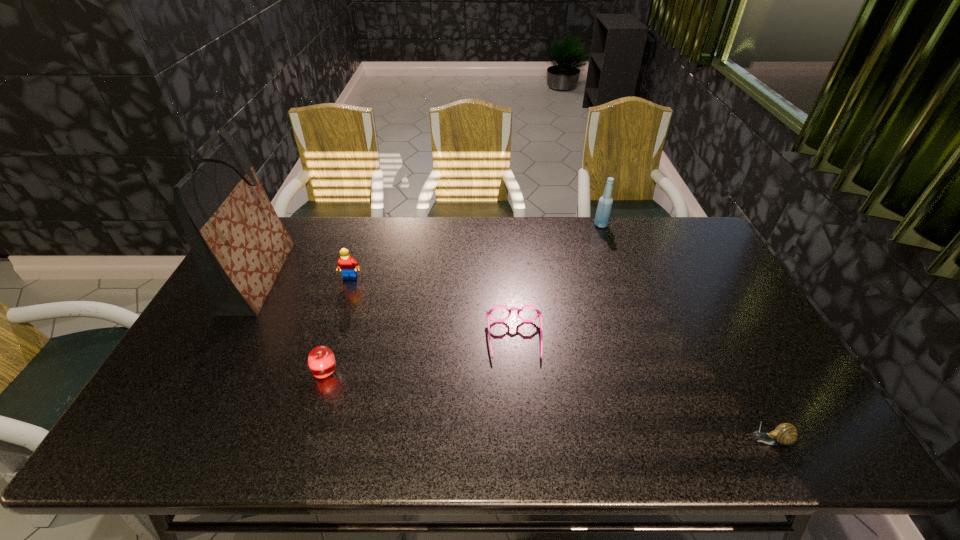
Image resolution: width=960 pixels, height=540 pixels. Identify the location of free space between the farthest object and the nearest object. (684, 333).

At what (x,y) coordinates should I click in order to perform the action: click on unoccupied position between the fourth shortest object and the fourth object from left to right. Please return your answer as a coordinate pair (x, y). The width and height of the screenshot is (960, 540). Looking at the image, I should click on (433, 309).

Where is `vacant area that lies between the fifth object from left to right and the nearest object`? Image resolution: width=960 pixels, height=540 pixels. vacant area that lies between the fifth object from left to right and the nearest object is located at coordinates (684, 333).

The width and height of the screenshot is (960, 540). I want to click on unoccupied area between the third object from right to left and the fifth object from left to right, so click(558, 283).

Where is `vacant space in between the farthest object and the apple`? The height and width of the screenshot is (540, 960). vacant space in between the farthest object and the apple is located at coordinates (463, 299).

What are the coordinates of `free area in between the tallest object and the escargot` in the screenshot? It's located at (514, 359).

This screenshot has width=960, height=540. Identify the location of vacant space that is in between the apple and the farthest object. (463, 299).

Locate an element on the screen. The width and height of the screenshot is (960, 540). free space between the fifth object from left to right and the third shortest object is located at coordinates (463, 299).

This screenshot has height=540, width=960. I want to click on free area in between the rightmost object and the fourth tallest object, so click(546, 407).

At what (x,y) coordinates should I click in order to perform the action: click on vacant space that's between the spectacles and the leftmost object. Please return your answer as a coordinate pair (x, y). This screenshot has height=540, width=960. Looking at the image, I should click on (388, 309).